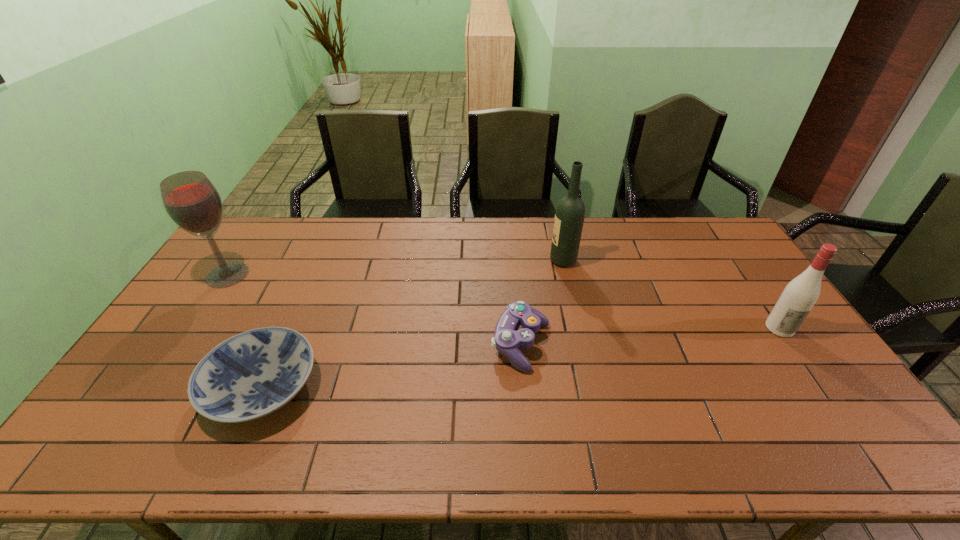
The width and height of the screenshot is (960, 540). I want to click on free space between the shortest object and the control, so click(x=392, y=366).

Select which object is the fourth closest to the second object from right to left. Please provide its 2D coordinates. Your answer should be formatted as a tuple, i.e. [(x, y)], where the tuple contains the x and y coordinates of a point satisfying the conditions above.

[(190, 199)]

In order to click on object that is the fourth closest to the shortest object in this screenshot , I will do `click(800, 295)`.

At what (x,y) coordinates should I click in order to perform the action: click on vacant point that satisfies the following two spatial constraints: 1. on the labeled side of the wine bottle; 2. on the front side of the third object from right to left. Please return your answer as a coordinate pair (x, y). This screenshot has height=540, width=960. Looking at the image, I should click on (582, 345).

Locate an element on the screen. This screenshot has width=960, height=540. vacant space that satisfies the following two spatial constraints: 1. on the labeled side of the wine bottle; 2. on the front side of the plate is located at coordinates (591, 387).

I want to click on vacant space that satisfies the following two spatial constraints: 1. on the back side of the plate; 2. on the right side of the control, so click(x=280, y=345).

Where is `vacant position in the image that satisfies the following two spatial constraints: 1. on the front side of the second object from left to right; 2. on the left side of the leftmost object`? vacant position in the image that satisfies the following two spatial constraints: 1. on the front side of the second object from left to right; 2. on the left side of the leftmost object is located at coordinates [154, 387].

Image resolution: width=960 pixels, height=540 pixels. In order to click on vacant space that satisfies the following two spatial constraints: 1. on the back side of the shortest object; 2. on the right side of the third object from left to right in this screenshot , I will do `click(280, 345)`.